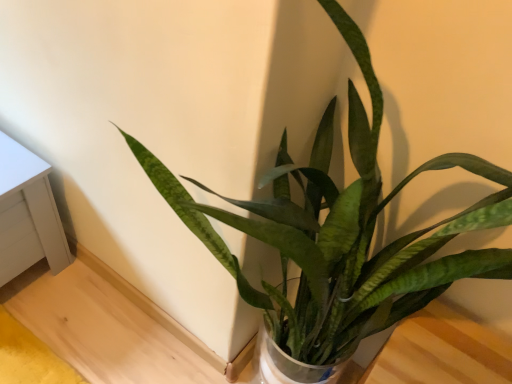
What do you see at coordinates (27, 213) in the screenshot? I see `white painted wood table at lower left` at bounding box center [27, 213].

Identify the location of white painted wood table at lower left. Image resolution: width=512 pixels, height=384 pixels. (27, 213).

Locate an element on the screen. The image size is (512, 384). white painted wood table at lower left is located at coordinates (27, 213).